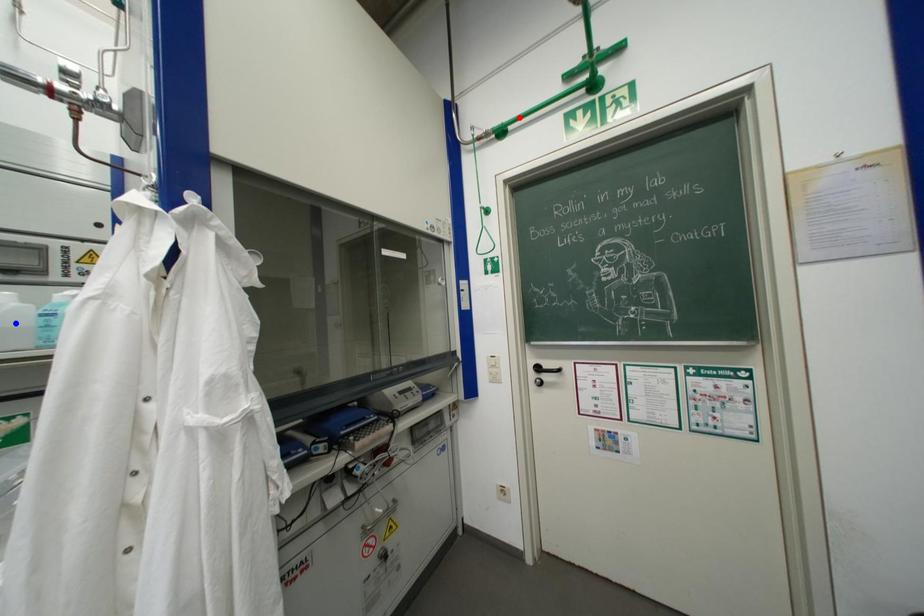
Question: Two points are marked on the image. Which point is closer to the camera?

Choices:
 (A) Blue point is closer.
 (B) Red point is closer.

Answer: (A)